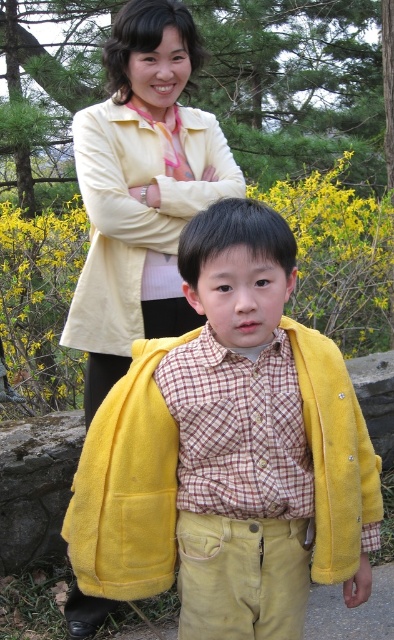
Question: Considering the relative positions of yellow fleece jacket at center and matte yellow jacket at upper center in the image provided, where is yellow fleece jacket at center located with respect to matte yellow jacket at upper center?

Choices:
 (A) right
 (B) left

Answer: (A)

Question: Which of the following is the farthest from the observer?

Choices:
 (A) yellow fleece jacket at center
 (B) matte yellow jacket at upper center

Answer: (B)

Question: Is yellow fleece jacket at center positioned in front of matte yellow jacket at upper center?

Choices:
 (A) yes
 (B) no

Answer: (A)

Question: From the image, what is the correct spatial relationship of yellow fleece jacket at center in relation to matte yellow jacket at upper center?

Choices:
 (A) right
 (B) left

Answer: (A)